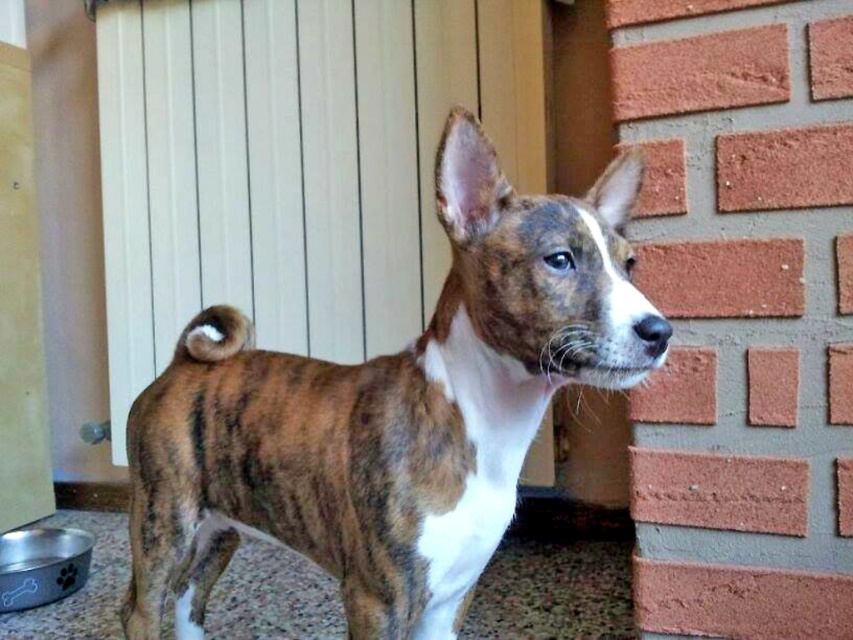
Question: Is white painted wood door at upper center thinner than wooden door at left?

Choices:
 (A) no
 (B) yes

Answer: (A)

Question: Among these points, which one is farthest from the camera?

Choices:
 (A) (138, 493)
 (B) (309, 240)

Answer: (B)

Question: Which of the following is the farthest from the observer?

Choices:
 (A) brown brindle dog at center
 (B) white painted wood door at upper center

Answer: (B)

Question: From the image, what is the correct spatial relationship of brown brindle dog at center in relation to white painted wood door at upper center?

Choices:
 (A) right
 (B) left

Answer: (A)

Question: Among these objects, which one is farthest from the camera?

Choices:
 (A) brown brindle dog at center
 (B) wooden door at left
 (C) white painted wood door at upper center

Answer: (B)

Question: Is white painted wood door at upper center bigger than wooden door at left?

Choices:
 (A) yes
 (B) no

Answer: (A)